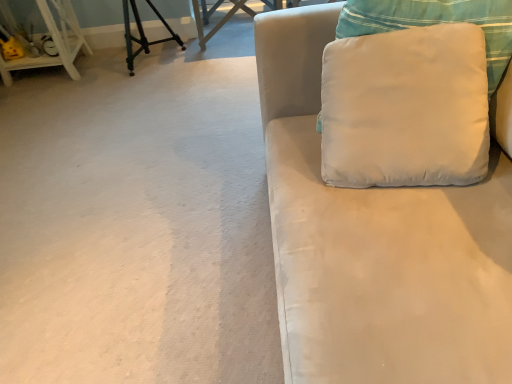
The image size is (512, 384). Find the location of `satin white couch at right`. satin white couch at right is located at coordinates (376, 244).

This screenshot has height=384, width=512. What do you see at coordinates (219, 21) in the screenshot? I see `wooden table at upper center` at bounding box center [219, 21].

What do you see at coordinates (54, 42) in the screenshot? I see `white wood shelf at left` at bounding box center [54, 42].

Locate an element on the screen. This screenshot has height=384, width=512. satin white couch at right is located at coordinates (376, 244).

Looking at this image, from the image's perspective, is satin white couch at right below white wood shelf at left?

Yes, from the image's perspective, satin white couch at right is beneath white wood shelf at left.

Is satin white couch at right situated inside white wood shelf at left or outside?

satin white couch at right is spatially situated outside white wood shelf at left.

How different are the orientations of white wood shelf at left and white fabric pillow at upper right in degrees?

white wood shelf at left and white fabric pillow at upper right are facing 9.47 degrees away from each other.

Considering the positions of objects white wood shelf at left and white fabric pillow at upper right in the image provided, who is more to the right, white wood shelf at left or white fabric pillow at upper right?

From the viewer's perspective, white fabric pillow at upper right appears more on the right side.

Which is in front, point (67, 15) or point (410, 149)?

Positioned in front is point (410, 149).

Looking at this image, is white fabric pillow at upper right directly adjacent to wooden table at upper center?

white fabric pillow at upper right is not next to wooden table at upper center, and they're not touching.

The height and width of the screenshot is (384, 512). Identify the location of table that appears above the white fabric pillow at upper right (from the image's perspective). (219, 21).

From the image's perspective, is white fabric pillow at upper right located above or below wooden table at upper center?

Based on their image positions, white fabric pillow at upper right is located beneath wooden table at upper center.

Is white fabric pillow at upper right thinner than wooden table at upper center?

Yes, white fabric pillow at upper right is thinner than wooden table at upper center.

Can you tell me how much white fabric pillow at upper right and satin white couch at right differ in facing direction?

There is a 78.1-degree angle between the facing directions of white fabric pillow at upper right and satin white couch at right.

Image resolution: width=512 pixels, height=384 pixels. What are the coordinates of `pillow above the satin white couch at right (from the image's perspective)` in the screenshot? It's located at (406, 108).

Which is nearer, (467, 113) or (326, 230)?

Point (467, 113) is farther from the camera than point (326, 230).

Choose the correct answer: Is white fabric pillow at upper right inside satin white couch at right or outside it?

white fabric pillow at upper right is enclosed within satin white couch at right.

Is white fabric pillow at upper right far away from white wood shelf at left?

Yes, white fabric pillow at upper right and white wood shelf at left are quite far apart.

The image size is (512, 384). I want to click on furniture that appears above the white fabric pillow at upper right (from the image's perspective), so click(x=54, y=42).

Does white fabric pillow at upper right turn towards white wood shelf at left?

No, white fabric pillow at upper right is not aimed at white wood shelf at left.

Is white fabric pillow at upper right to the left of white wood shelf at left from the viewer's perspective?

In fact, white fabric pillow at upper right is to the right of white wood shelf at left.

Is white wood shelf at left positioned beyond the bounds of satin white couch at right?

white wood shelf at left lies outside satin white couch at right's area.

Which of these two, white wood shelf at left or satin white couch at right, is thinner?

With smaller width is white wood shelf at left.

From a real-world perspective, is white wood shelf at left beneath satin white couch at right?

Indeed, from a real-world perspective, white wood shelf at left is positioned beneath satin white couch at right.

From the picture: From a real-world perspective, is white wood shelf at left below wooden table at upper center?

No, from a real-world perspective, white wood shelf at left is not below wooden table at upper center.

Can you see white wood shelf at left touching wooden table at upper center?

There is a gap between white wood shelf at left and wooden table at upper center.

Does white wood shelf at left appear on the left side of wooden table at upper center?

Correct, you'll find white wood shelf at left to the left of wooden table at upper center.

From the picture: Is white wood shelf at left oriented away from wooden table at upper center?

No, white wood shelf at left is not facing the opposite direction of wooden table at upper center.

Image resolution: width=512 pixels, height=384 pixels. In order to click on studio couch in front of the white wood shelf at left in this screenshot , I will do `click(376, 244)`.

This screenshot has height=384, width=512. In order to click on pillow below the white wood shelf at left (from the image's perspective) in this screenshot , I will do `click(406, 108)`.

From the image, which object appears to be farther from white fabric pillow at upper right, white wood shelf at left or satin white couch at right?

Among the two, white wood shelf at left is located further to white fabric pillow at upper right.

From the image, which object appears to be nearer to white wood shelf at left, white fabric pillow at upper right or satin white couch at right?

Based on the image, satin white couch at right appears to be nearer to white wood shelf at left.

From the image, which object appears to be farther from satin white couch at right, white wood shelf at left or wooden table at upper center?

The object further to satin white couch at right is white wood shelf at left.

Estimate the real-world distances between objects in this image. Which object is further from wooden table at upper center, white fabric pillow at upper right or satin white couch at right?

Based on the image, satin white couch at right appears to be further to wooden table at upper center.

Estimate the real-world distances between objects in this image. Which object is closer to white fabric pillow at upper right, white wood shelf at left or wooden table at upper center?

The object closer to white fabric pillow at upper right is wooden table at upper center.

Looking at the image, which one is located further to white wood shelf at left, satin white couch at right or wooden table at upper center?

satin white couch at right.

Which object lies nearer to the anchor point white wood shelf at left, wooden table at upper center or satin white couch at right?

wooden table at upper center is closer to white wood shelf at left.

Considering their positions, is white wood shelf at left positioned closer to wooden table at upper center than white fabric pillow at upper right?

Based on the image, white wood shelf at left appears to be nearer to wooden table at upper center.

The height and width of the screenshot is (384, 512). I want to click on table between white wood shelf at left and white fabric pillow at upper right in the horizontal direction, so click(219, 21).

This screenshot has height=384, width=512. Identify the location of pillow between white wood shelf at left and satin white couch at right. (406, 108).

Find the location of a particular element. furniture between satin white couch at right and wooden table at upper center in the front-back direction is located at coordinates (54, 42).

Find the location of a particular element. Image resolution: width=512 pixels, height=384 pixels. pillow between satin white couch at right and wooden table at upper center along the z-axis is located at coordinates (406, 108).